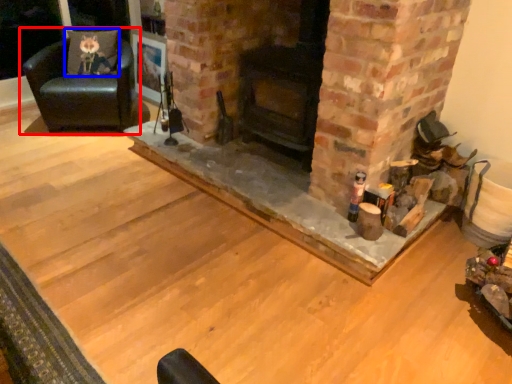
Question: Among these objects, which one is farthest to the camera, chair (highlighted by a red box) or pillow (highlighted by a blue box)?

Choices:
 (A) chair
 (B) pillow

Answer: (B)